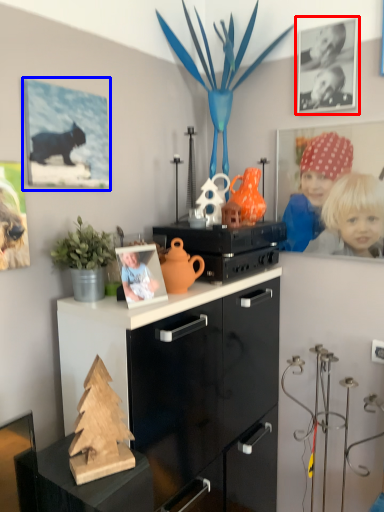
Question: Which object appears closest to the camera in this image, picture frame (highlighted by a red box) or picture frame (highlighted by a blue box)?

Choices:
 (A) picture frame
 (B) picture frame

Answer: (B)